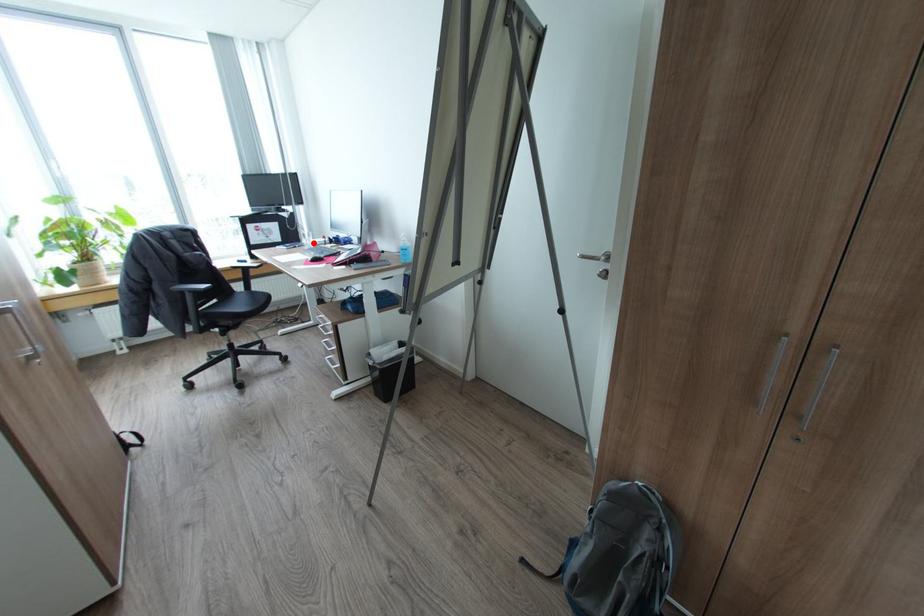
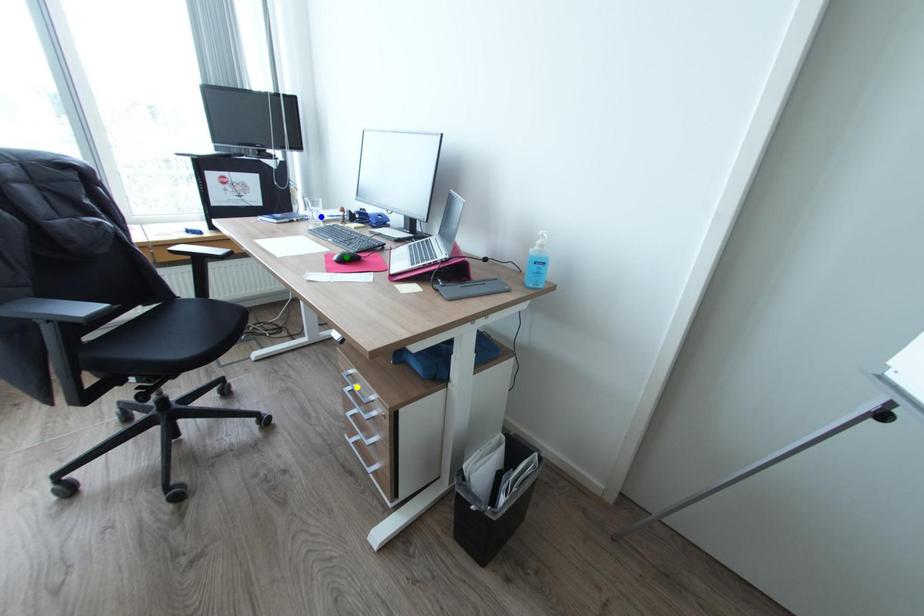
Question: I am providing you with two images of the same scene from different viewpoints. A red point is marked on the first image. You are given multiple points on the second image. Which point in image 2 is actually the same real-world point as the red point in image 1?

Choices:
 (A) green point
 (B) blue point
 (C) yellow point

Answer: (B)